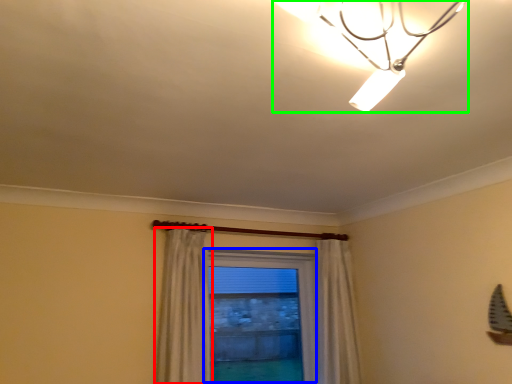
Question: Estimate the real-world distances between objects in this image. Which object is closer to curtain (highlighted by a red box), window (highlighted by a blue box) or lamp (highlighted by a green box)?

Choices:
 (A) window
 (B) lamp

Answer: (B)